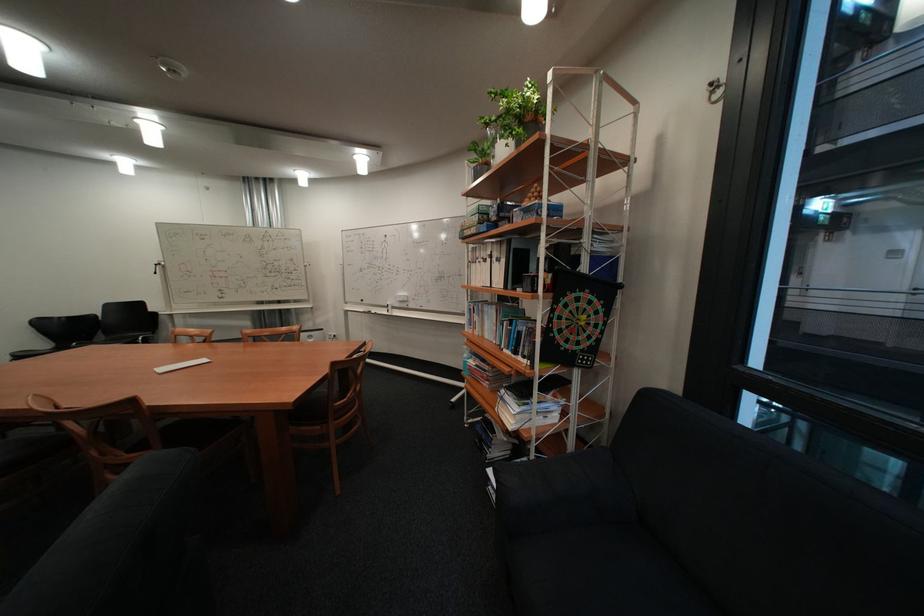
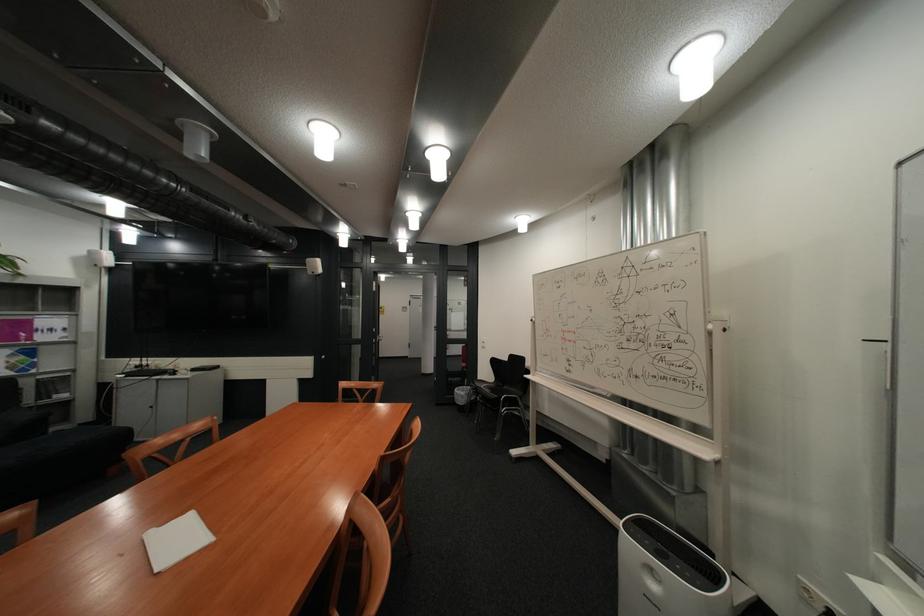
Find the pixel in the second image that matches the point at 321,264 in the first image.

(725, 326)